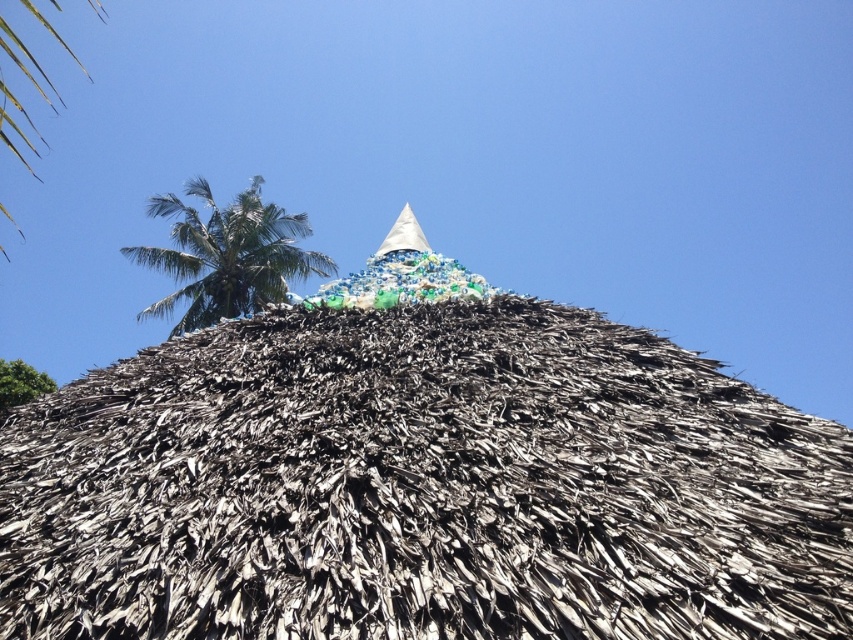
You are standing in front of the traditional thatched roof structure. You notice both the brown thatch roof at center and the green leafy palm tree at upper left. Which one is taller?

The brown thatch roof at center has a lesser height compared to green leafy palm tree at upper left, so the green leafy palm tree at upper left is taller.

You are standing at the origin point of the image coordinate system. Where is the brown thatch roof at center located?

The brown thatch roof at center is located at point (422, 486).